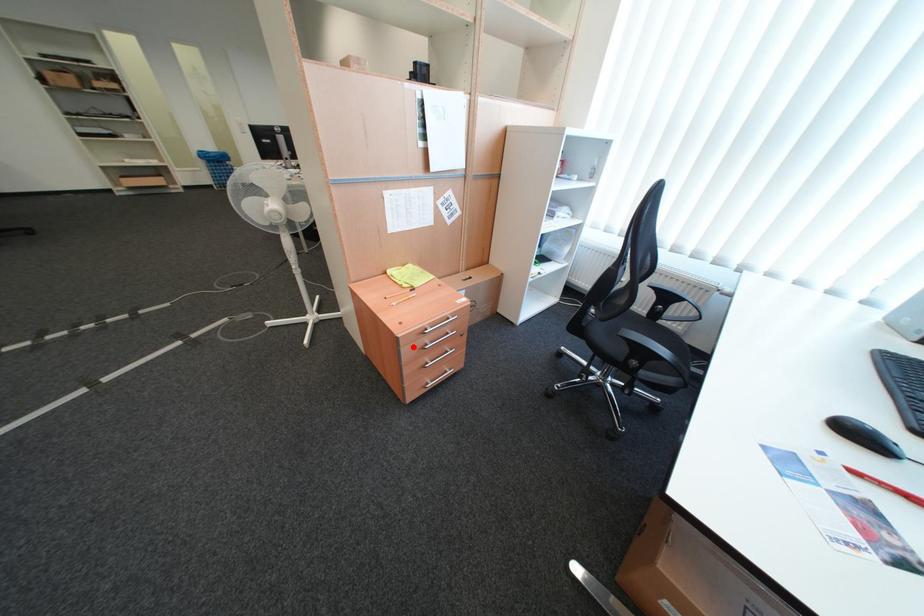
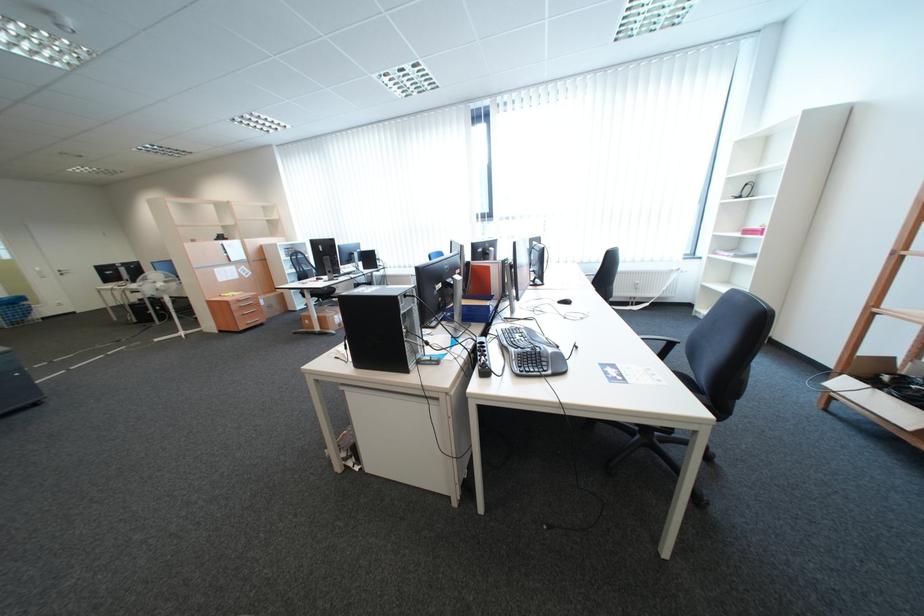
Where in the second image is the point corresponding to the highlighted location from the first image?

(242, 305)